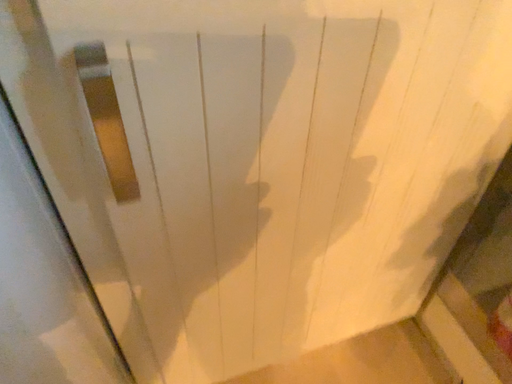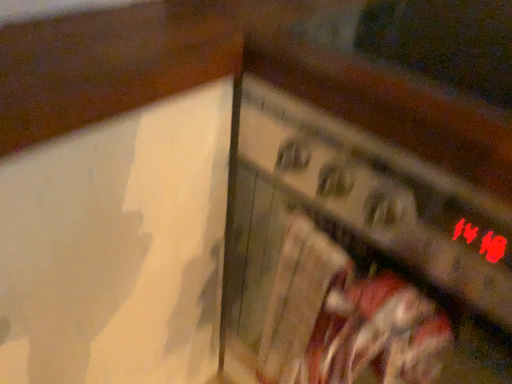
Question: How did the camera likely rotate when shooting the video?

Choices:
 (A) rotated downward
 (B) rotated upward

Answer: (B)